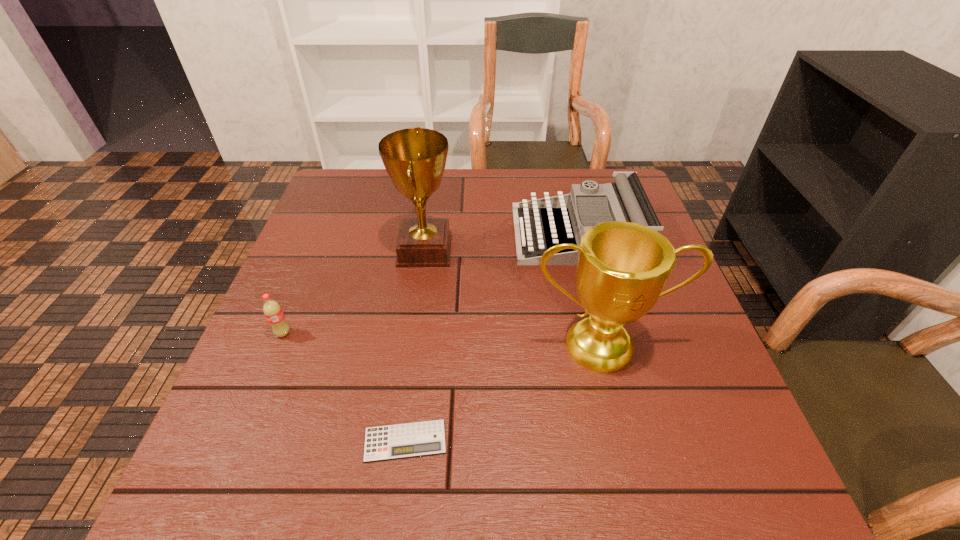
The height and width of the screenshot is (540, 960). In order to click on vacant area that lies between the shortest object and the farther award in this screenshot , I will do `click(415, 346)`.

Locate an element on the screen. The height and width of the screenshot is (540, 960). free area in between the typewriter and the farther award is located at coordinates click(503, 242).

Locate an element on the screen. This screenshot has height=540, width=960. free space between the calculator and the typewriter is located at coordinates [x=493, y=338].

In order to click on free space between the soda and the nearer award in this screenshot , I will do `click(443, 339)`.

What are the coordinates of `the fourth closest object to the typewriter` in the screenshot? It's located at (273, 312).

I want to click on the closest object to the right award, so click(x=626, y=200).

Where is `blank area in the image that satisfies the following two spatial constraints: 1. on the plaque of the farther award; 2. on the back side of the shortest object`? The width and height of the screenshot is (960, 540). blank area in the image that satisfies the following two spatial constraints: 1. on the plaque of the farther award; 2. on the back side of the shortest object is located at coordinates (398, 441).

In order to click on vacant space that satisfies the following two spatial constraints: 1. on the plaque of the left award; 2. on the back side of the shortest object in this screenshot , I will do `click(398, 441)`.

At what (x,y) coordinates should I click in order to perform the action: click on free point that satisfies the following two spatial constraints: 1. on the front side of the shortest object; 2. on the left side of the leftmost object. Please return your answer as a coordinate pair (x, y). The height and width of the screenshot is (540, 960). Looking at the image, I should click on (239, 441).